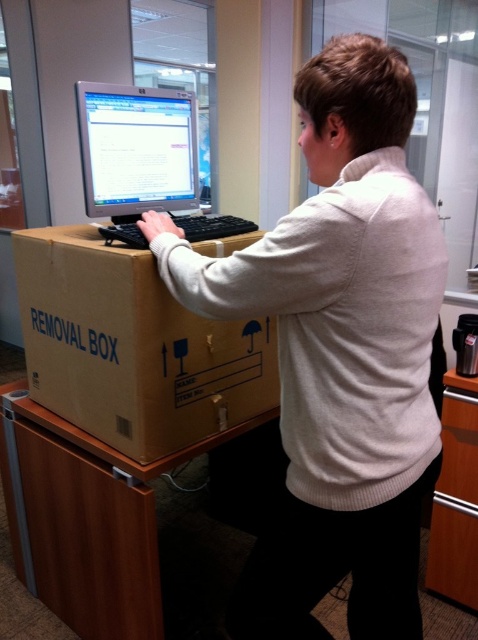
Question: Which point is farther to the camera?

Choices:
 (A) black plastic keyboard at center
 (B) white sweater at center
 (C) matte black monitor at center
 (D) brown wood/file cabinet at lower right

Answer: (D)

Question: Which of these objects is positioned closest to the brown cardboard box at center?

Choices:
 (A) white sweater at center
 (B) matte black monitor at center

Answer: (B)

Question: Can you confirm if brown cardboard box at center is bigger than black plastic keyboard at center?

Choices:
 (A) yes
 (B) no

Answer: (A)

Question: Which point is farther from the camera taking this photo?

Choices:
 (A) (142, 236)
 (B) (390, 154)

Answer: (A)

Question: Observing the image, what is the correct spatial positioning of brown cardboard box at center in reference to matte black monitor at center?

Choices:
 (A) above
 (B) below

Answer: (B)

Question: Does brown cardboard box at center appear under brown wood/file cabinet at lower right?

Choices:
 (A) yes
 (B) no

Answer: (B)